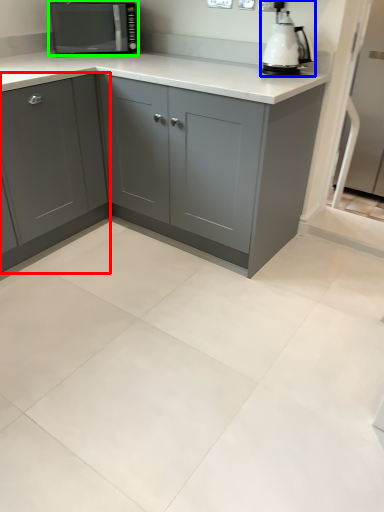
Question: Considering the real-world distances, which object is farthest from cabinetry (highlighted by a red box)? home appliance (highlighted by a blue box) or kitchen appliance (highlighted by a green box)?

Choices:
 (A) home appliance
 (B) kitchen appliance

Answer: (A)